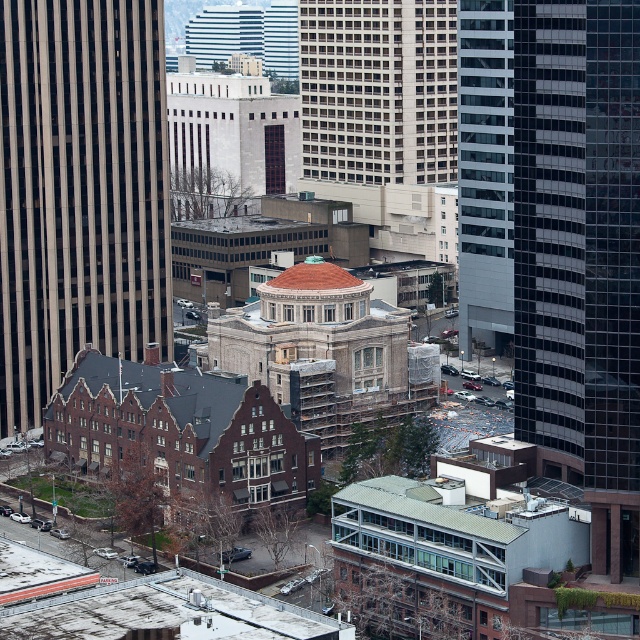
Who is higher up, beige glass skyscraper at left or beige stone building at center?

beige stone building at center

Is beige glass skyscraper at left wider than beige stone building at center?

No, beige glass skyscraper at left is not wider than beige stone building at center.

You are a GUI agent. You are given a task and a screenshot of the screen. Output one action in this format:
    pyautogui.click(x=<x>, y=<y>)
    Task: Click on the beige glass skyscraper at left
    The image size is (640, 640).
    Given the screenshot: What is the action you would take?
    pyautogui.click(x=80, y=192)